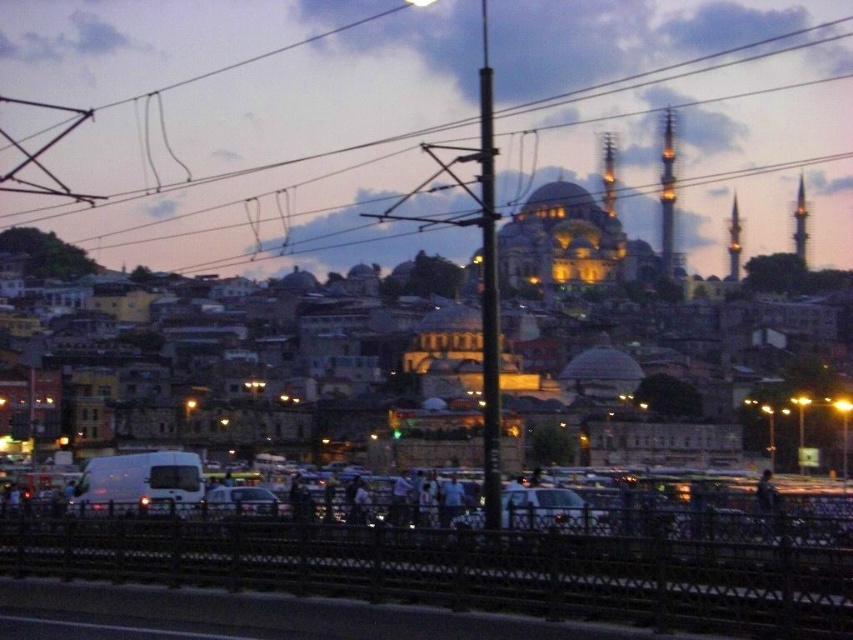
The image size is (853, 640). Describe the element at coordinates (242, 124) in the screenshot. I see `metallic wire at upper center` at that location.

Does metallic wire at upper center have a larger size compared to white matte car at center?

Yes, metallic wire at upper center is bigger than white matte car at center.

What are the coordinates of `metallic wire at upper center` in the screenshot? It's located at (242, 124).

The height and width of the screenshot is (640, 853). Find the location of `metallic wire at upper center`. metallic wire at upper center is located at coordinates (242, 124).

Between metallic wire at upper center and white glossy car at center, which one is positioned lower?

Positioned lower is white glossy car at center.

Is point (183, 28) farther from viewer compared to point (537, 506)?

That is True.

At what (x,y) coordinates should I click in order to perform the action: click on metallic wire at upper center. Please return your answer as a coordinate pair (x, y). Looking at the image, I should click on (242, 124).

Does white glossy car at center have a greater width compared to white matte car at center?

Yes, white glossy car at center is wider than white matte car at center.

Does white glossy car at center have a lesser height compared to white matte car at center?

Indeed, white glossy car at center has a lesser height compared to white matte car at center.

What do you see at coordinates (549, 509) in the screenshot? I see `white glossy car at center` at bounding box center [549, 509].

Image resolution: width=853 pixels, height=640 pixels. I want to click on white glossy car at center, so click(549, 509).